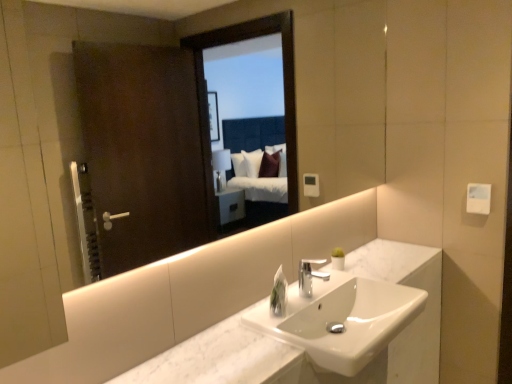
This screenshot has height=384, width=512. In order to click on vacant area located to the right-hand side of silver metallic faucet at center in this screenshot , I will do `click(332, 283)`.